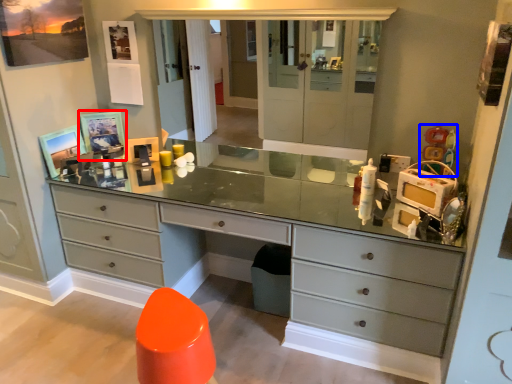
Question: Which of the following is the farthest to the observer, picture frame (highlighted by a red box) or toy (highlighted by a blue box)?

Choices:
 (A) picture frame
 (B) toy

Answer: (A)